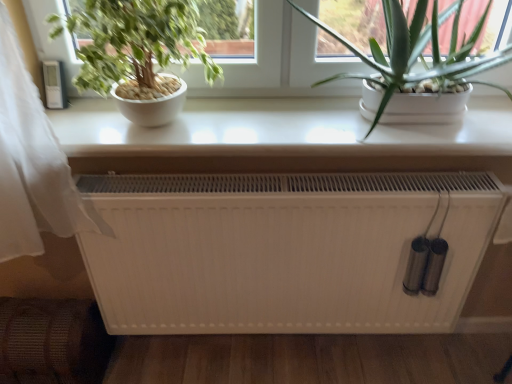
Describe the element at coordinates (284, 250) in the screenshot. I see `white matte heater at center` at that location.

Find the location of a particular element. white glossy table at upper center is located at coordinates (280, 138).

The height and width of the screenshot is (384, 512). What do you see at coordinates (280, 138) in the screenshot? I see `white glossy table at upper center` at bounding box center [280, 138].

Where is `green leafy plant at upper left`? The width and height of the screenshot is (512, 384). green leafy plant at upper left is located at coordinates (277, 62).

Describe the element at coordinates (417, 52) in the screenshot. The width and height of the screenshot is (512, 384). I see `green leafy plant at upper right, which is the 2th houseplant from left to right` at that location.

Locate an element on the screen. The width and height of the screenshot is (512, 384). white matte heater at center is located at coordinates (284, 250).

Is green matte plant at left, which appears as the first houseplant when viewed from the left, bigger than green leafy plant at upper right, which is the 2th houseplant from left to right?

Actually, green matte plant at left, which appears as the first houseplant when viewed from the left, might be smaller than green leafy plant at upper right, which is the 2th houseplant from left to right.

Identify the location of houseplant above the green matte plant at left, the 2th houseplant from the right (from a real-world perspective). Image resolution: width=512 pixels, height=384 pixels. (417, 52).

Is green matte plant at left, the 2th houseplant from the right, positioned in front of green leafy plant at upper right, which is the 2th houseplant from left to right?

That is False.

Does white glossy table at upper center touch green leafy plant at upper left?

They are not placed beside each other.

Is white glossy table at upper center looking in the opposite direction of green leafy plant at upper left?

white glossy table at upper center does not have its back to green leafy plant at upper left.

From the image's perspective, which object appears higher, white glossy table at upper center or green leafy plant at upper left?

green leafy plant at upper left is shown above in the image.

Which is correct: white glossy table at upper center is inside green leafy plant at upper left, or outside of it?

white glossy table at upper center is not enclosed by green leafy plant at upper left.

Is green matte plant at left, which appears as the first houseplant when viewed from the left, looking in the opposite direction of green leafy plant at upper left?

Absolutely, green matte plant at left, which appears as the first houseplant when viewed from the left, is directed away from green leafy plant at upper left.

Is point (144, 64) closer to camera compared to point (286, 52)?

Yes, point (144, 64) is closer to viewer.

Considering the positions of objects green matte plant at left, the 2th houseplant from the right, and green leafy plant at upper left in the image provided, who is in front, green matte plant at left, the 2th houseplant from the right, or green leafy plant at upper left?

green matte plant at left, the 2th houseplant from the right, is more forward.

From the image's perspective, which is above, green leafy plant at upper right, which is the 2th houseplant from left to right, or green matte plant at left, the 2th houseplant from the right?

green leafy plant at upper right, which is the 2th houseplant from left to right, is shown above in the image.

Considering the sizes of objects green leafy plant at upper right, acting as the first houseplant starting from the right, and green matte plant at left, which appears as the first houseplant when viewed from the left, in the image provided, who is shorter, green leafy plant at upper right, acting as the first houseplant starting from the right, or green matte plant at left, which appears as the first houseplant when viewed from the left,?

green matte plant at left, which appears as the first houseplant when viewed from the left.

In terms of width, does green leafy plant at upper right, which is the 2th houseplant from left to right, look wider or thinner when compared to green matte plant at left, which appears as the first houseplant when viewed from the left?

green leafy plant at upper right, which is the 2th houseplant from left to right, is wider than green matte plant at left, which appears as the first houseplant when viewed from the left.

Considering the relative sizes of green leafy plant at upper right, acting as the first houseplant starting from the right, and white glossy table at upper center in the image provided, is green leafy plant at upper right, acting as the first houseplant starting from the right, shorter than white glossy table at upper center?

No, green leafy plant at upper right, acting as the first houseplant starting from the right, is not shorter than white glossy table at upper center.

At what (x,y) coordinates should I click in order to perform the action: click on the 2nd houseplant above the white glossy table at upper center (from the image's perspective). Please return your answer as a coordinate pair (x, y). This screenshot has height=384, width=512. Looking at the image, I should click on (417, 52).

Is green leafy plant at upper right, acting as the first houseplant starting from the right, in front of or behind white glossy table at upper center in the image?

green leafy plant at upper right, acting as the first houseplant starting from the right, is positioned closer to the viewer than white glossy table at upper center.

Can you confirm if green matte plant at left, the 2th houseplant from the right, is smaller than white matte heater at center?

Yes.

Between green matte plant at left, the 2th houseplant from the right, and white matte heater at center, which one has more height?

white matte heater at center is taller.

From a real-world perspective, between green matte plant at left, the 2th houseplant from the right, and white matte heater at center, who is vertically lower?

In real-world perspective, white matte heater at center is lower.

Can you tell me how much white matte heater at center and green leafy plant at upper right, acting as the first houseplant starting from the right, differ in facing direction?

The angle between the facing direction of white matte heater at center and the facing direction of green leafy plant at upper right, acting as the first houseplant starting from the right, is 0.431 degrees.

Identify the location of heater that is under the green leafy plant at upper right, which is the 2th houseplant from left to right (from a real-world perspective). (284, 250).

From a real-world perspective, between white matte heater at center and green leafy plant at upper right, which is the 2th houseplant from left to right, who is vertically higher?

green leafy plant at upper right, which is the 2th houseplant from left to right, is physically above.

Considering their positions, is white matte heater at center located in front of or behind green leafy plant at upper right, which is the 2th houseplant from left to right?

white matte heater at center is behind green leafy plant at upper right, which is the 2th houseplant from left to right.

The height and width of the screenshot is (384, 512). I want to click on houseplant directly beneath the green leafy plant at upper right, acting as the first houseplant starting from the right (from a real-world perspective), so click(138, 53).

In order to click on table in front of the green leafy plant at upper left in this screenshot , I will do `click(280, 138)`.

Considering their positions, is green leafy plant at upper left positioned closer to green leafy plant at upper right, which is the 2th houseplant from left to right, than white matte heater at center?

The object closer to green leafy plant at upper right, which is the 2th houseplant from left to right, is green leafy plant at upper left.

From the picture: Based on their spatial positions, is green matte plant at left, the 2th houseplant from the right, or white matte heater at center further from green leafy plant at upper right, acting as the first houseplant starting from the right?

The object further to green leafy plant at upper right, acting as the first houseplant starting from the right, is green matte plant at left, the 2th houseplant from the right.

Which object lies nearer to the anchor point white glossy table at upper center, green leafy plant at upper right, acting as the first houseplant starting from the right, or green matte plant at left, which appears as the first houseplant when viewed from the left?

Answer: green leafy plant at upper right, acting as the first houseplant starting from the right.

When comparing their distances from green leafy plant at upper right, which is the 2th houseplant from left to right, does white matte heater at center or white glossy table at upper center seem closer?

Based on the image, white glossy table at upper center appears to be nearer to green leafy plant at upper right, which is the 2th houseplant from left to right.

Considering their positions, is green matte plant at left, the 2th houseplant from the right, positioned further to white glossy table at upper center than green leafy plant at upper left?

green matte plant at left, the 2th houseplant from the right, is positioned further to the anchor white glossy table at upper center.

Which object lies further to the anchor point green leafy plant at upper left, white matte heater at center or white glossy table at upper center?

The object further to green leafy plant at upper left is white matte heater at center.

Looking at the image, which one is located closer to white matte heater at center, green leafy plant at upper left or green leafy plant at upper right, acting as the first houseplant starting from the right?

green leafy plant at upper right, acting as the first houseplant starting from the right, is positioned closer to the anchor white matte heater at center.

Considering their positions, is green leafy plant at upper right, which is the 2th houseplant from left to right, positioned closer to white matte heater at center than green matte plant at left, which appears as the first houseplant when viewed from the left?

green leafy plant at upper right, which is the 2th houseplant from left to right, lies closer to white matte heater at center than the other object.

This screenshot has width=512, height=384. I want to click on table between green matte plant at left, the 2th houseplant from the right, and green leafy plant at upper left from left to right, so [x=280, y=138].

Identify the location of window screen situated between green matte plant at left, which appears as the first houseplant when viewed from the left, and green leafy plant at upper right, which is the 2th houseplant from left to right, from left to right. Image resolution: width=512 pixels, height=384 pixels. (277, 62).

The height and width of the screenshot is (384, 512). In order to click on table between green matte plant at left, which appears as the first houseplant when viewed from the left, and green leafy plant at upper right, which is the 2th houseplant from left to right, in the horizontal direction in this screenshot , I will do `click(280, 138)`.

Where is `window screen between white glossy table at upper center and green leafy plant at upper right, which is the 2th houseplant from left to right, in the horizontal direction`? The width and height of the screenshot is (512, 384). window screen between white glossy table at upper center and green leafy plant at upper right, which is the 2th houseplant from left to right, in the horizontal direction is located at coordinates (277, 62).